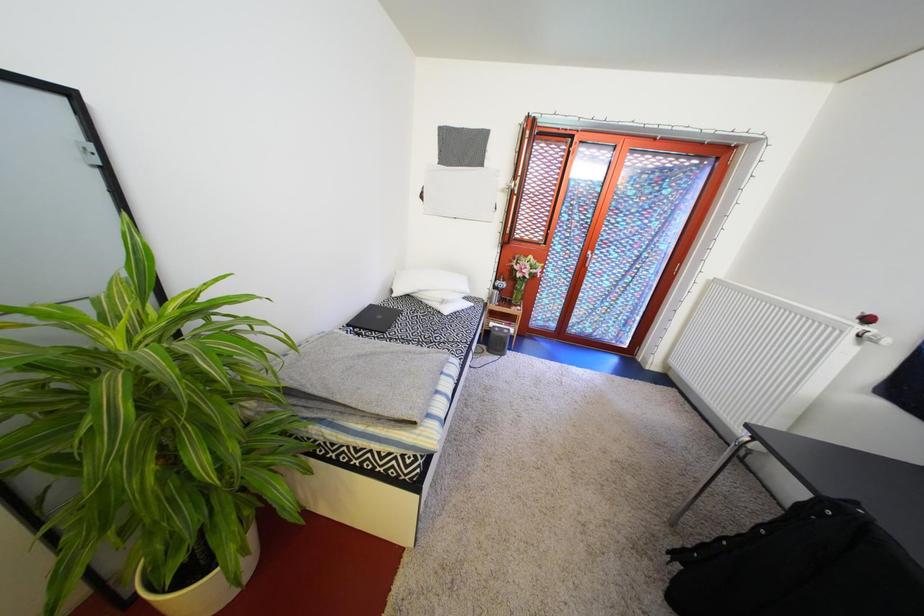
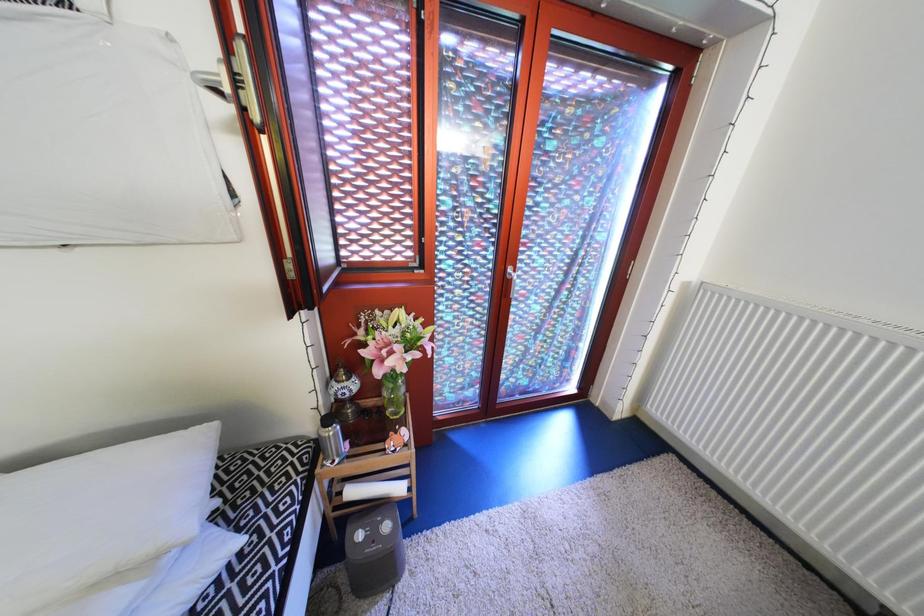
Question: The images are taken continuously from a first-person perspective. In which direction are you moving?

Choices:
 (A) Left
 (B) Right
 (C) Forward
 (D) Backward

Answer: (C)